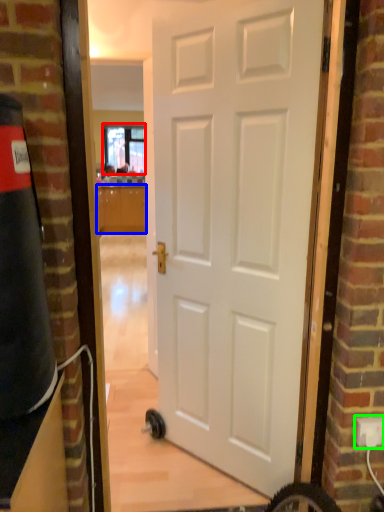
Question: Which is farther away from window (highlighted by a red box)? cabinetry (highlighted by a blue box) or electric outlet (highlighted by a green box)?

Choices:
 (A) cabinetry
 (B) electric outlet

Answer: (B)